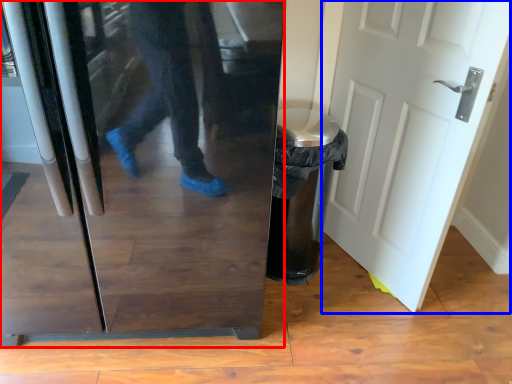
Question: Which object is closer to the camera taking this photo, refrigerator (highlighted by a red box) or door (highlighted by a blue box)?

Choices:
 (A) refrigerator
 (B) door

Answer: (A)